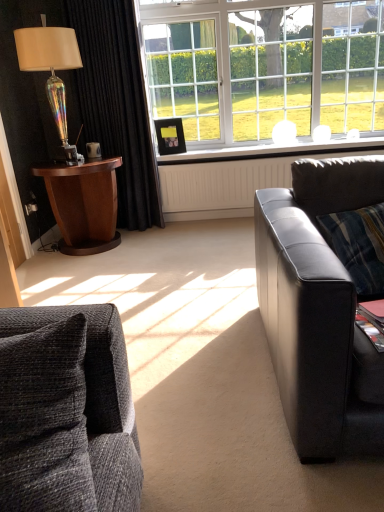
Describe the element at coordinates (51, 70) in the screenshot. The height and width of the screenshot is (512, 384). I see `iridescent glass lamp at left` at that location.

Image resolution: width=384 pixels, height=512 pixels. What do you see at coordinates (170, 136) in the screenshot?
I see `wooden picture frame at upper center` at bounding box center [170, 136].

What do you see at coordinates (319, 310) in the screenshot?
I see `black leather couch at right, arranged as the 1th studio couch when viewed from the back` at bounding box center [319, 310].

You are a GUI agent. You are given a task and a screenshot of the screen. Output one action in this format:
    pyautogui.click(x=<x>, y=<y>)
    Task: Click on the wooden side table at left
    
    Given the screenshot: What is the action you would take?
    pyautogui.click(x=83, y=203)

Describe the element at coordinates (117, 104) in the screenshot. The image size is (384, 512). I see `black velvet curtain at left` at that location.

In order to face clear glass window at upper center, should I rotate leftwards or rightwards?

To face it directly, rotate right by 9.560 degrees.

The width and height of the screenshot is (384, 512). What are the coordinates of `iridescent glass lamp at left` in the screenshot? It's located at (51, 70).

From a real-world perspective, is textured gray couch at lower left, positioned as the 2th studio couch in back-to-front order, positioned above or below wooden side table at left?

From a real-world perspective, textured gray couch at lower left, positioned as the 2th studio couch in back-to-front order, is physically above wooden side table at left.

Where is `table on the left of textured gray couch at lower left, positioned as the second studio couch in right-to-left order`? The image size is (384, 512). table on the left of textured gray couch at lower left, positioned as the second studio couch in right-to-left order is located at coordinates (83, 203).

Is textured gray couch at lower left, which is counted as the 1th studio couch, starting from the left, aimed at wooden side table at left?

No, textured gray couch at lower left, which is counted as the 1th studio couch, starting from the left, is not aimed at wooden side table at left.

Which is in front, textured gray couch at lower left, marked as the first studio couch in a front-to-back arrangement, or black leather couch at right, the 1th studio couch viewed from the right?

textured gray couch at lower left, marked as the first studio couch in a front-to-back arrangement.

From a real-world perspective, is textured gray couch at lower left, which is counted as the 1th studio couch, starting from the left, above or below black leather couch at right, arranged as the 1th studio couch when viewed from the back?

From a real-world perspective, textured gray couch at lower left, which is counted as the 1th studio couch, starting from the left, is physically above black leather couch at right, arranged as the 1th studio couch when viewed from the back.

Considering the sizes of objects textured gray couch at lower left, positioned as the second studio couch in right-to-left order, and black leather couch at right, the 1th studio couch viewed from the right, in the image provided, who is taller, textured gray couch at lower left, positioned as the second studio couch in right-to-left order, or black leather couch at right, the 1th studio couch viewed from the right,?

black leather couch at right, the 1th studio couch viewed from the right.

From the picture: Considering the positions of objects black leather couch at right, which appears as the second studio couch when viewed from the left, and iridescent glass lamp at left in the image provided, who is more to the left, black leather couch at right, which appears as the second studio couch when viewed from the left, or iridescent glass lamp at left?

Positioned to the left is iridescent glass lamp at left.

Considering the relative sizes of black leather couch at right, the 1th studio couch viewed from the right, and iridescent glass lamp at left in the image provided, is black leather couch at right, the 1th studio couch viewed from the right, wider than iridescent glass lamp at left?

Correct, the width of black leather couch at right, the 1th studio couch viewed from the right, exceeds that of iridescent glass lamp at left.

In the scene shown: From a real-world perspective, is black leather couch at right, arranged as the 1th studio couch when viewed from the back, located higher than iridescent glass lamp at left?

No, from a real-world perspective, black leather couch at right, arranged as the 1th studio couch when viewed from the back, is not over iridescent glass lamp at left

Can you confirm if iridescent glass lamp at left is bigger than white plastic window sill at center?

Correct, iridescent glass lamp at left is larger in size than white plastic window sill at center.

Looking at this image, between iridescent glass lamp at left and white plastic window sill at center, which one has less height?

white plastic window sill at center is shorter.

Is iridescent glass lamp at left wider or thinner than white plastic window sill at center?

Considering their sizes, iridescent glass lamp at left looks broader than white plastic window sill at center.

The width and height of the screenshot is (384, 512). Find the location of `window sill behind the iridescent glass lamp at left`. window sill behind the iridescent glass lamp at left is located at coordinates (x=274, y=151).

Can you tell me how much wooden picture frame at upper center and clear glass window at upper center differ in facing direction?

The angular difference between wooden picture frame at upper center and clear glass window at upper center is 21.7 degrees.

Can you confirm if wooden picture frame at upper center is bigger than clear glass window at upper center?

Incorrect, wooden picture frame at upper center is not larger than clear glass window at upper center.

Considering the sizes of objects wooden picture frame at upper center and clear glass window at upper center in the image provided, who is shorter, wooden picture frame at upper center or clear glass window at upper center?

Standing shorter between the two is wooden picture frame at upper center.

In the scene shown: Would you say black velvet curtain at left contains wooden side table at left?

No, wooden side table at left is located outside of black velvet curtain at left.

Is black velvet curtain at left looking in the opposite direction of wooden side table at left?

black velvet curtain at left does not have its back to wooden side table at left.

Looking at this image, is black velvet curtain at left to the left or to the right of wooden side table at left in the image?

In the image, black velvet curtain at left appears on the right side of wooden side table at left.

Are black velvet curtain at left and wooden side table at left beside each other?

No, black velvet curtain at left is not with wooden side table at left.

In terms of size, does black velvet curtain at left appear bigger or smaller than black plastic power outlet at lower left?

In the image, black velvet curtain at left appears to be larger than black plastic power outlet at lower left.

Which object is thinner, black velvet curtain at left or black plastic power outlet at lower left?

black plastic power outlet at lower left is thinner.

From the image's perspective, which object appears higher, black velvet curtain at left or black plastic power outlet at lower left?

black velvet curtain at left.

Can black plastic power outlet at lower left be found inside black velvet curtain at left?

No, black plastic power outlet at lower left is not inside black velvet curtain at left.

What are the coordinates of `table beneath the textured gray couch at lower left, positioned as the 2th studio couch in back-to-front order (from a real-world perspective)` in the screenshot? It's located at (83, 203).

Identify the location of studio couch below the black leather couch at right, the 1th studio couch viewed from the right (from the image's perspective). This screenshot has width=384, height=512. coord(66,412).

Looking at the image, which one is located further to black velvet curtain at left, wooden side table at left or textured gray couch at lower left, positioned as the second studio couch in right-to-left order?

textured gray couch at lower left, positioned as the second studio couch in right-to-left order, lies further to black velvet curtain at left than the other object.

Based on their spatial positions, is clear glass window at upper center or black plastic power outlet at lower left further from wooden picture frame at upper center?

clear glass window at upper center lies further to wooden picture frame at upper center than the other object.

Estimate the real-world distances between objects in this image. Which object is closer to clear glass window at upper center, textured gray couch at lower left, positioned as the 2th studio couch in back-to-front order, or black leather couch at right, which is counted as the second studio couch, starting from the front?

textured gray couch at lower left, positioned as the 2th studio couch in back-to-front order, is closer to clear glass window at upper center.

Considering their positions, is black velvet curtain at left positioned closer to white plastic window sill at center than wooden picture frame at upper center?

wooden picture frame at upper center is positioned closer to the anchor white plastic window sill at center.

Which object lies further to the anchor point iridescent glass lamp at left, wooden side table at left or black leather couch at right, arranged as the 1th studio couch when viewed from the back?

black leather couch at right, arranged as the 1th studio couch when viewed from the back, lies further to iridescent glass lamp at left than the other object.

Estimate the real-world distances between objects in this image. Which object is closer to clear glass window at upper center, textured gray couch at lower left, which is counted as the 1th studio couch, starting from the left, or white plastic window sill at center?

textured gray couch at lower left, which is counted as the 1th studio couch, starting from the left, lies closer to clear glass window at upper center than the other object.

When comparing their distances from black plastic power outlet at lower left, does wooden side table at left or clear glass window at upper center seem further?

clear glass window at upper center lies further to black plastic power outlet at lower left than the other object.

In the scene shown: Considering their positions, is textured gray couch at lower left, positioned as the second studio couch in right-to-left order, positioned further to black velvet curtain at left than wooden picture frame at upper center?

Among the two, textured gray couch at lower left, positioned as the second studio couch in right-to-left order, is located further to black velvet curtain at left.

I want to click on table between black leather couch at right, which appears as the second studio couch when viewed from the left, and wooden picture frame at upper center, along the z-axis, so click(x=83, y=203).

You are a GUI agent. You are given a task and a screenshot of the screen. Output one action in this format:
    pyautogui.click(x=<x>, y=<y>)
    Task: Click on the table between textured gray couch at lower left, marked as the first studio couch in a front-to-back arrangement, and black plastic power outlet at lower left in the front-back direction
    
    Given the screenshot: What is the action you would take?
    pyautogui.click(x=83, y=203)

What are the coordinates of `window between wooden picture frame at upper center and white plastic window sill at center in the horizontal direction` in the screenshot? It's located at (264, 67).

You are a GUI agent. You are given a task and a screenshot of the screen. Output one action in this format:
    pyautogui.click(x=<x>, y=<y>)
    Task: Click on the picture frame between wooden side table at left and clear glass window at upper center in the horizontal direction
    This screenshot has height=512, width=384.
    Given the screenshot: What is the action you would take?
    pyautogui.click(x=170, y=136)